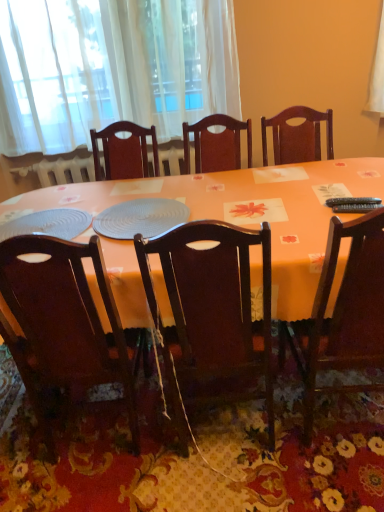
Measure the distance between point (146, 188) and camera.

Point (146, 188) and camera are 1.98 meters apart from each other.

Find the location of a particular element. The image size is (384, 512). black plastic remote control at right, arranged as the first remote control when viewed from the top is located at coordinates (352, 201).

Describe the element at coordinates (112, 68) in the screenshot. I see `white sheer curtain at upper left` at that location.

In order to click on white sheer curtain at upper left in this screenshot , I will do `click(112, 68)`.

Measure the distance between matte blue placemat at center and camera.

The distance of matte blue placemat at center from camera is 4.78 feet.

The height and width of the screenshot is (512, 384). Identify the location of dark wood chair at lower left, the 3th chair when ordered from right to left. (68, 317).

From the image's perspective, which is above, dark wood chair at lower left, the 3th chair when ordered from right to left, or wooden chair at right, which is the first chair in right-to-left order?

From the image's view, wooden chair at right, which is the first chair in right-to-left order, is above.

Considering the positions of point (7, 334) and point (358, 338), is point (7, 334) closer or farther from the camera than point (358, 338)?

Point (7, 334) is positioned farther from the camera compared to point (358, 338).

Which of these two, dark wood chair at lower left, the 3th chair when ordered from right to left, or wooden chair at right, the 3th chair in the left-to-right sequence, is wider?

With larger width is wooden chair at right, the 3th chair in the left-to-right sequence.

Considering the positions of objects dark wood chair at lower left, the 3th chair when ordered from right to left, and wooden chair at right, which is the first chair in right-to-left order, in the image provided, who is in front, dark wood chair at lower left, the 3th chair when ordered from right to left, or wooden chair at right, which is the first chair in right-to-left order,?

wooden chair at right, which is the first chair in right-to-left order, is more forward.

I want to click on platter behind the dark wood chair at lower left, arranged as the 1th chair when viewed from the left, so click(140, 218).

From the image's perspective, is dark wood chair at lower left, the 3th chair when ordered from right to left, beneath matte blue placemat at center?

Correct, dark wood chair at lower left, the 3th chair when ordered from right to left, appears lower than matte blue placemat at center in the image.

Which is less distant, (16, 260) or (109, 220)?

The point (16, 260) is in front.

From the image's perspective, is wooden chair at right, the 3th chair in the left-to-right sequence, above or below dark wood chair at center, which is the second chair in left-to-right order?

wooden chair at right, the 3th chair in the left-to-right sequence, is situated higher than dark wood chair at center, which is the second chair in left-to-right order, in the image.

Is wooden chair at right, which is the first chair in right-to-left order, turned away from dark wood chair at center, marked as the 2th chair in a right-to-left arrangement?

No, dark wood chair at center, marked as the 2th chair in a right-to-left arrangement, is not at the back of wooden chair at right, which is the first chair in right-to-left order.

Does point (361, 311) come in front of point (244, 296)?

No, (361, 311) is further to viewer.

From the image's perspective, which object appears higher, dark wood chair at center, marked as the 2th chair in a right-to-left arrangement, or black plastic remote control at right, arranged as the first remote control when viewed from the top?

black plastic remote control at right, arranged as the first remote control when viewed from the top.

Is dark wood chair at center, which is the second chair in left-to-right order, inside or outside of black plastic remote control at right, the 2th remote control ordered from the bottom?

dark wood chair at center, which is the second chair in left-to-right order, is located beyond the bounds of black plastic remote control at right, the 2th remote control ordered from the bottom.

What's the angular difference between dark wood chair at center, marked as the 2th chair in a right-to-left arrangement, and black plastic remote control at right, arranged as the first remote control when viewed from the top,'s facing directions?

The angle between the facing direction of dark wood chair at center, marked as the 2th chair in a right-to-left arrangement, and the facing direction of black plastic remote control at right, arranged as the first remote control when viewed from the top, is 109 degrees.

Considering the positions of point (221, 357) and point (361, 200), is point (221, 357) closer or farther from the camera than point (361, 200)?

Clearly, point (221, 357) is closer to the camera than point (361, 200).

Is matte blue placemat at center inside white sheer curtain at upper left?

No.

Are white sheer curtain at upper left and matte blue placemat at center far apart?

white sheer curtain at upper left is positioned a significant distance from matte blue placemat at center.

Which is more to the right, white sheer curtain at upper left or matte blue placemat at center?

matte blue placemat at center.

Locate an element on the screen. The width and height of the screenshot is (384, 512). platter on the right of white sheer curtain at upper left is located at coordinates (140, 218).

Which of these two, black plastic remote control at right, which is counted as the 2th remote control, starting from the top, or orange fabric table at center, is thinner?

black plastic remote control at right, which is counted as the 2th remote control, starting from the top.

From the image's perspective, is black plastic remote control at right, which is counted as the 2th remote control, starting from the top, under orange fabric table at center?

No, from the image's perspective, black plastic remote control at right, which is counted as the 2th remote control, starting from the top, is not below orange fabric table at center.

Is black plastic remote control at right, which appears as the 1th remote control when ordered from the bottom, to the left of orange fabric table at center from the viewer's perspective?

No, black plastic remote control at right, which appears as the 1th remote control when ordered from the bottom, is not to the left of orange fabric table at center.

The image size is (384, 512). I want to click on remote control that is the 1st one when counting upward from the orange fabric table at center (from the image's perspective), so click(x=357, y=208).

From the image's perspective, between wooden chair at right, the 3th chair in the left-to-right sequence, and orange fabric table at center, who is located below?

From the image's view, wooden chair at right, the 3th chair in the left-to-right sequence, is below.

Considering the sizes of objects wooden chair at right, which is the first chair in right-to-left order, and orange fabric table at center in the image provided, who is thinner, wooden chair at right, which is the first chair in right-to-left order, or orange fabric table at center?

wooden chair at right, which is the first chair in right-to-left order.

I want to click on desk that is under the wooden chair at right, the 3th chair in the left-to-right sequence (from a real-world perspective), so click(x=248, y=204).

Based on their positions, is wooden chair at right, which is the first chair in right-to-left order, located to the left or right of orange fabric table at center?

Clearly, wooden chair at right, which is the first chair in right-to-left order, is on the right of orange fabric table at center in the image.

Find the location of a particular element. This screenshot has width=384, height=512. the 2nd chair behind the wooden chair at right, the 3th chair in the left-to-right sequence is located at coordinates (68, 317).

Find the location of `chair on the left side of matte blue placemat at center`. chair on the left side of matte blue placemat at center is located at coordinates (68, 317).

Which object lies further to the anchor point orange fabric table at center, dark wood chair at center, which is the second chair in left-to-right order, or dark wood chair at lower left, arranged as the 1th chair when viewed from the left?

dark wood chair at lower left, arranged as the 1th chair when viewed from the left, lies further to orange fabric table at center than the other object.

From the image, which object appears to be nearer to wooden chair at right, the 3th chair in the left-to-right sequence, dark wood chair at lower left, arranged as the 1th chair when viewed from the left, or black plastic remote control at right, which is counted as the 2th remote control, starting from the top?

black plastic remote control at right, which is counted as the 2th remote control, starting from the top, lies closer to wooden chair at right, the 3th chair in the left-to-right sequence, than the other object.

Considering their positions, is dark wood chair at center, which is the second chair in left-to-right order, positioned closer to matte blue placemat at center than white sheer curtain at upper left?

Among the two, dark wood chair at center, which is the second chair in left-to-right order, is located nearer to matte blue placemat at center.

Based on their spatial positions, is black plastic remote control at right, which appears as the 1th remote control when ordered from the bottom, or matte blue placemat at center closer to wooden chair at right, which is the first chair in right-to-left order?

black plastic remote control at right, which appears as the 1th remote control when ordered from the bottom, is positioned closer to the anchor wooden chair at right, which is the first chair in right-to-left order.

When comparing their distances from orange fabric table at center, does dark wood chair at center, which is the second chair in left-to-right order, or matte blue placemat at center seem closer?

matte blue placemat at center lies closer to orange fabric table at center than the other object.

From the image, which object appears to be farther from black plastic remote control at right, which appears as the 1th remote control when ordered from the bottom, white sheer curtain at upper left or black plastic remote control at right, arranged as the first remote control when viewed from the top?

white sheer curtain at upper left.

Considering their positions, is wooden chair at right, which is the first chair in right-to-left order, positioned closer to black plastic remote control at right, which is counted as the 2th remote control, starting from the top, than dark wood chair at center, which is the second chair in left-to-right order?

Among the two, wooden chair at right, which is the first chair in right-to-left order, is located nearer to black plastic remote control at right, which is counted as the 2th remote control, starting from the top.

Looking at the image, which one is located further to dark wood chair at lower left, arranged as the 1th chair when viewed from the left, black plastic remote control at right, which appears as the 1th remote control when ordered from the bottom, or black plastic remote control at right, the 2th remote control ordered from the bottom?

The object further to dark wood chair at lower left, arranged as the 1th chair when viewed from the left, is black plastic remote control at right, the 2th remote control ordered from the bottom.

Find the location of `platter located between white sheer curtain at upper left and black plastic remote control at right, the 2th remote control ordered from the bottom, in the left-right direction`. platter located between white sheer curtain at upper left and black plastic remote control at right, the 2th remote control ordered from the bottom, in the left-right direction is located at coordinates (140, 218).

Find the location of `chair between orange fabric table at center and wooden chair at right, which is the first chair in right-to-left order, in the horizontal direction`. chair between orange fabric table at center and wooden chair at right, which is the first chair in right-to-left order, in the horizontal direction is located at coordinates (212, 303).

The height and width of the screenshot is (512, 384). Identify the location of platter located between white sheer curtain at upper left and black plastic remote control at right, which is counted as the 2th remote control, starting from the top, in the left-right direction. (140, 218).

Where is `chair between dark wood chair at center, marked as the 2th chair in a right-to-left arrangement, and black plastic remote control at right, which appears as the 1th remote control when ordered from the bottom, from left to right`? The image size is (384, 512). chair between dark wood chair at center, marked as the 2th chair in a right-to-left arrangement, and black plastic remote control at right, which appears as the 1th remote control when ordered from the bottom, from left to right is located at coordinates (343, 313).